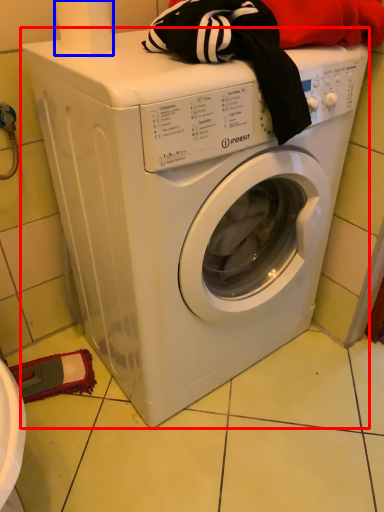
Question: Which object is closer to the camera taking this photo, washing machine (highlighted by a red box) or toilet paper (highlighted by a blue box)?

Choices:
 (A) washing machine
 (B) toilet paper

Answer: (A)